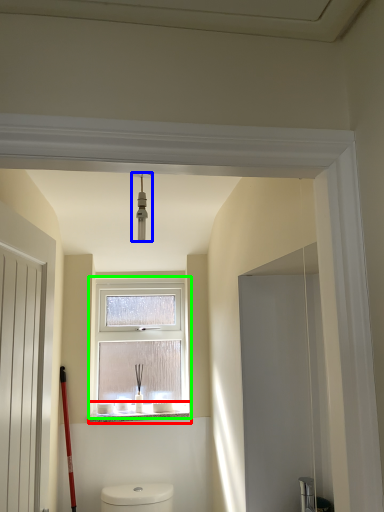
Question: Which is farther away from window sill (highlighted by a red box)? light fixture (highlighted by a blue box) or window (highlighted by a green box)?

Choices:
 (A) light fixture
 (B) window

Answer: (A)